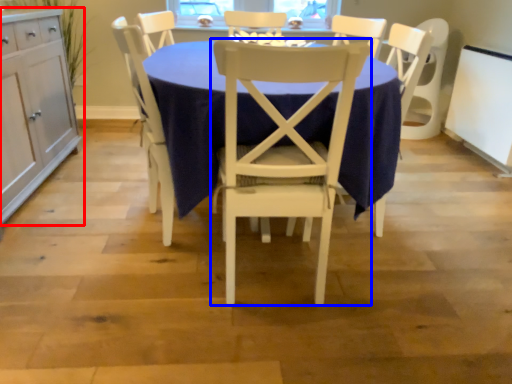
Question: Among these objects, which one is nearest to the camera, cabinetry (highlighted by a red box) or chair (highlighted by a blue box)?

Choices:
 (A) cabinetry
 (B) chair

Answer: (B)